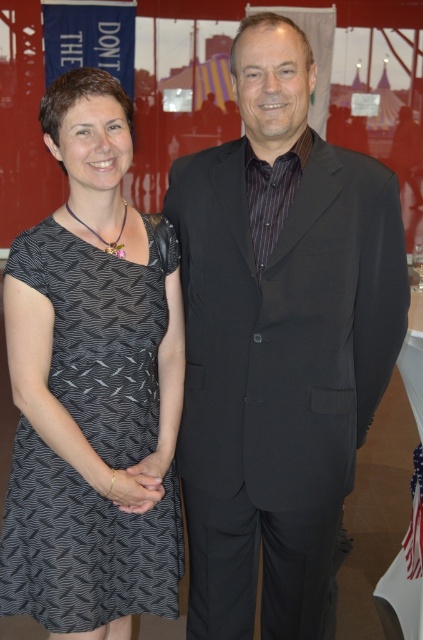
You are at a formal event and need to find the shortest path to exit. There are two points marked in the image. The first point is at coordinates point (x=288, y=45) and the second is at point (x=148, y=321). Which point is closer to you from your current position?

Point (x=288, y=45) is in front of point (x=148, y=321), so it is closer to you.

You are organizing a charity event and need to ensure that all attendees have proper seating. The black matte suit at center and the black printed fabric dress at left are part of the guest attire. Based on their sizes, which guest might require a larger chair?

The black matte suit at center is larger in size than the black printed fabric dress at left, so the guest wearing the black matte suit at center might require a larger chair.

You are a photographer at a formal event. You need to position the black matte suit at center and the black printed fabric dress at left in a way that maintains their height difference. How should you arrange them?

The black matte suit at center is taller than the black printed fabric dress at left, so to maintain their height difference, the black matte suit at center should be placed in a position where it remains taller than the black printed fabric dress at left, such as positioning it slightly behind or elevated compared to the dress.